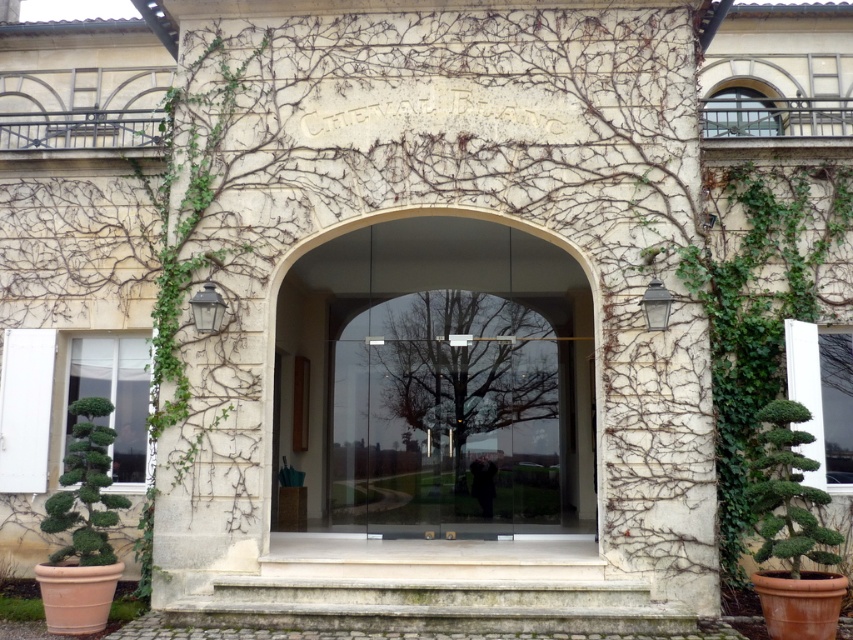
Question: Which of the following is the farthest from the observer?

Choices:
 (A) (757, 456)
 (B) (358, 444)
 (C) (73, 522)

Answer: (B)

Question: Among these points, which one is farthest from the camera?

Choices:
 (A) (432, 298)
 (B) (93, 520)

Answer: (A)

Question: Among these objects, which one is farthest from the camera?

Choices:
 (A) transparent glass door at center
 (B) green leafy bush at lower left

Answer: (A)

Question: From the image, what is the correct spatial relationship of green leafy bush at right in relation to green leafy bush at lower left?

Choices:
 (A) right
 (B) left

Answer: (A)

Question: Is green leafy bush at right to the left of green leafy bush at lower left from the viewer's perspective?

Choices:
 (A) yes
 (B) no

Answer: (B)

Question: Can you confirm if transparent glass door at center is positioned to the right of green leafy bush at lower left?

Choices:
 (A) no
 (B) yes

Answer: (B)